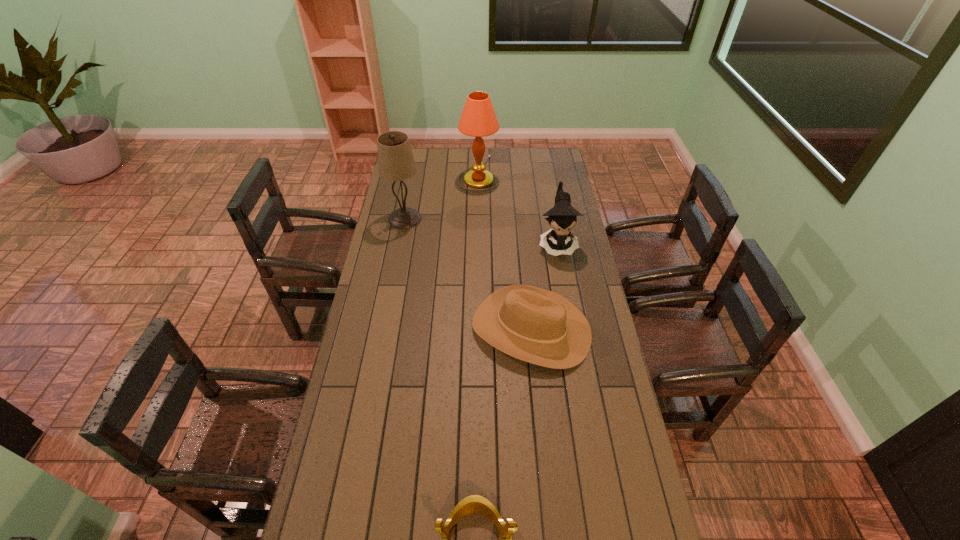
Find the location of a particular element. lamp is located at coordinates (478, 119).

This screenshot has height=540, width=960. I want to click on lampshade, so click(x=396, y=162).

Locate an element on the screen. doll is located at coordinates (562, 217).

This screenshot has width=960, height=540. I want to click on cowboy hat, so click(x=535, y=325).

At what (x,y) coordinates should I click in order to perform the action: click on the fourth farthest object. Please return your answer as a coordinate pair (x, y). Looking at the image, I should click on (535, 325).

I want to click on vacant space located 0.250m on the front of the lamp, so click(477, 223).

Identify the location of free spot located on the front-facing side of the lampshade. This screenshot has width=960, height=540. (486, 219).

You are a GUI agent. You are given a task and a screenshot of the screen. Output one action in this format:
    pyautogui.click(x=<x>, y=<y>)
    Task: Click on the free space located at the face of the doll
    The height and width of the screenshot is (540, 960).
    Given the screenshot: What is the action you would take?
    pyautogui.click(x=564, y=287)

The width and height of the screenshot is (960, 540). Find the location of `vacant region located on the front of the fourth tallest object`. vacant region located on the front of the fourth tallest object is located at coordinates (537, 389).

Find the location of a particular element. object located in the far edge section of the desktop is located at coordinates (478, 119).